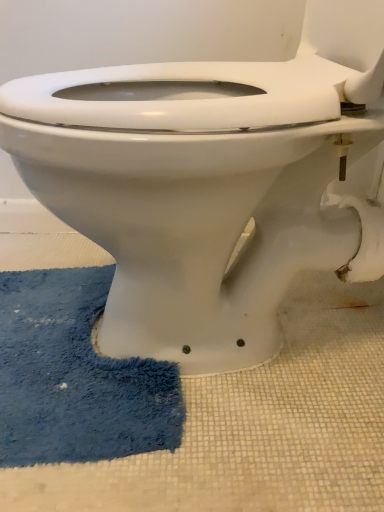
Question: Considering the relative positions of white glossy toilet at center and blue plush bath mat at lower left in the image provided, is white glossy toilet at center in front of blue plush bath mat at lower left?

Choices:
 (A) no
 (B) yes

Answer: (B)

Question: Is white glossy toilet at center thinner than blue plush bath mat at lower left?

Choices:
 (A) yes
 (B) no

Answer: (B)

Question: Is white glossy toilet at center turned away from blue plush bath mat at lower left?

Choices:
 (A) yes
 (B) no

Answer: (B)

Question: Is white glossy toilet at center bigger than blue plush bath mat at lower left?

Choices:
 (A) yes
 (B) no

Answer: (A)

Question: From a real-world perspective, does white glossy toilet at center sit lower than blue plush bath mat at lower left?

Choices:
 (A) no
 (B) yes

Answer: (A)

Question: Is blue plush bath mat at lower left completely or partially inside white glossy toilet at center?

Choices:
 (A) yes
 (B) no

Answer: (B)

Question: Is blue plush bath mat at lower left looking in the opposite direction of white glossy toilet at center?

Choices:
 (A) no
 (B) yes

Answer: (A)

Question: Does blue plush bath mat at lower left have a greater height compared to white glossy toilet at center?

Choices:
 (A) no
 (B) yes

Answer: (A)

Question: Does blue plush bath mat at lower left have a smaller size compared to white glossy toilet at center?

Choices:
 (A) yes
 (B) no

Answer: (A)

Question: Is the position of blue plush bath mat at lower left more distant than that of white glossy toilet at center?

Choices:
 (A) yes
 (B) no

Answer: (A)

Question: From the image's perspective, is blue plush bath mat at lower left below white glossy toilet at center?

Choices:
 (A) no
 (B) yes

Answer: (B)

Question: Is blue plush bath mat at lower left surrounding white glossy toilet at center?

Choices:
 (A) no
 (B) yes

Answer: (A)

Question: In the image, is white glossy toilet at center on the left side or the right side of blue plush bath mat at lower left?

Choices:
 (A) right
 (B) left

Answer: (A)